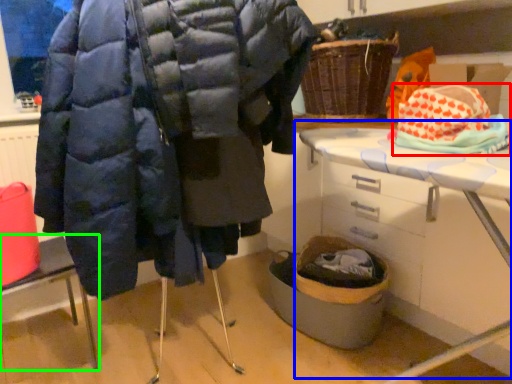
Question: Which object is positioned farthest from material (highlighted by a red box)? Select from table (highlighted by a blue box) and furniture (highlighted by a green box).

Choices:
 (A) table
 (B) furniture

Answer: (B)